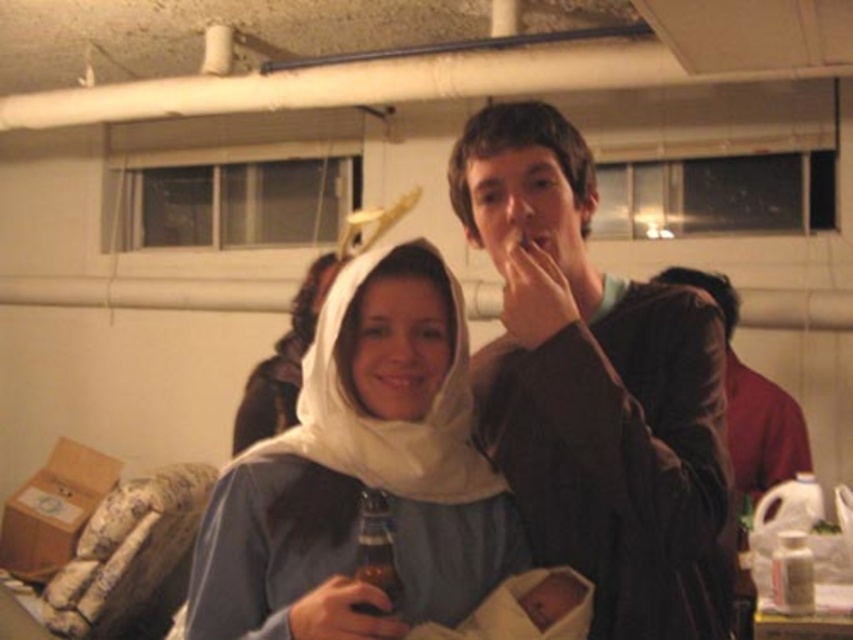
Question: Which point appears farthest from the camera in this image?

Choices:
 (A) (236, 522)
 (B) (718, 276)
 (C) (503, 470)
 (D) (376, 580)

Answer: (B)

Question: Is brown matte jacket at center in front of brown glass bottle at center?

Choices:
 (A) yes
 (B) no

Answer: (B)

Question: Does brown matte jacket at center have a lesser width compared to dark brown leather jacket at right?

Choices:
 (A) yes
 (B) no

Answer: (A)

Question: Does white cloth at center appear on the left side of brown glass bottle at center?

Choices:
 (A) yes
 (B) no

Answer: (B)

Question: Which is nearer to the dark brown leather jacket at right?

Choices:
 (A) white cloth at center
 (B) brown matte jacket at center

Answer: (B)

Question: Which object is closer to the camera taking this photo?

Choices:
 (A) brown matte jacket at center
 (B) brown glass bottle at center
 (C) dark brown leather jacket at right
 (D) white cloth at center

Answer: (D)